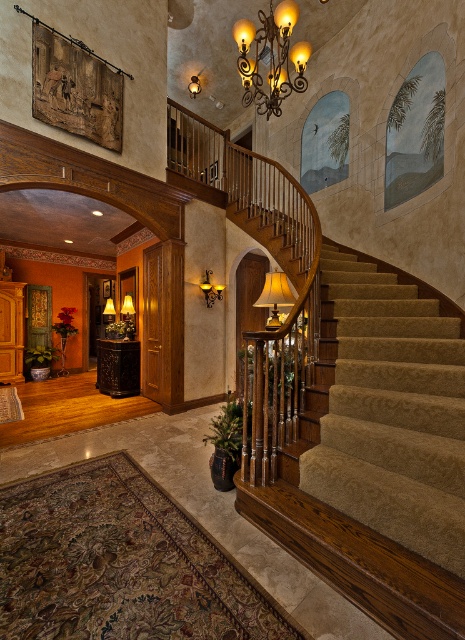
In the scene shown: Is golden wrought iron chandelier at upper center wider than matte gold wall sconce at upper center?

Indeed, golden wrought iron chandelier at upper center has a greater width compared to matte gold wall sconce at upper center.

Who is more distant from viewer, [273,93] or [221,298]?

Positioned behind is point [221,298].

I want to click on golden wrought iron chandelier at upper center, so click(271, 58).

Does carpeted stairs at center lie in front of golden wrought iron chandelier at upper center?

Yes, it is.

What do you see at coordinates (392, 413) in the screenshot? This screenshot has height=640, width=465. I see `carpeted stairs at center` at bounding box center [392, 413].

Is point (378, 298) positioned after point (251, 68)?

Yes, point (378, 298) is farther from viewer.

Image resolution: width=465 pixels, height=640 pixels. Identify the location of carpeted stairs at center. (392, 413).

Between point (384, 477) and point (272, 323), which one is positioned in front?

Point (384, 477)

Does point (403, 305) come closer to viewer compared to point (285, 294)?

No.

Locate an element on the screen. The image size is (465, 640). carpeted stairs at center is located at coordinates (392, 413).